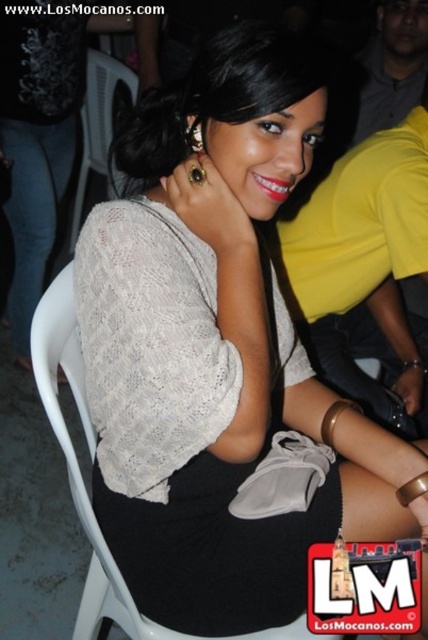
Between point (89, 600) and point (104, 61), which one is positioned behind?

The point (104, 61) is behind.

Does point (110, 563) lie in front of point (70, 237)?

Yes, it is.

Where is `white plastic chair at center`? The width and height of the screenshot is (428, 640). white plastic chair at center is located at coordinates 77,460.

Where is `white plastic chair at center`? white plastic chair at center is located at coordinates tap(77, 460).